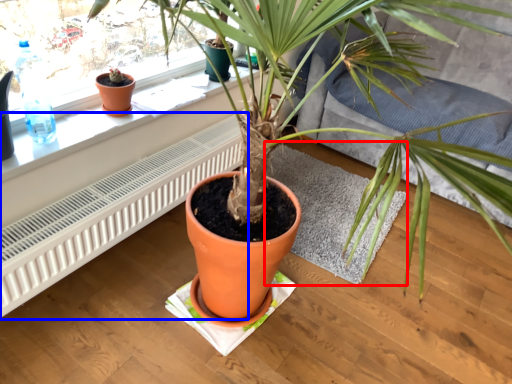
Question: Which object appears farthest to the camera in this image, wide (highlighted by a red box) or air conditioner (highlighted by a blue box)?

Choices:
 (A) wide
 (B) air conditioner

Answer: (A)